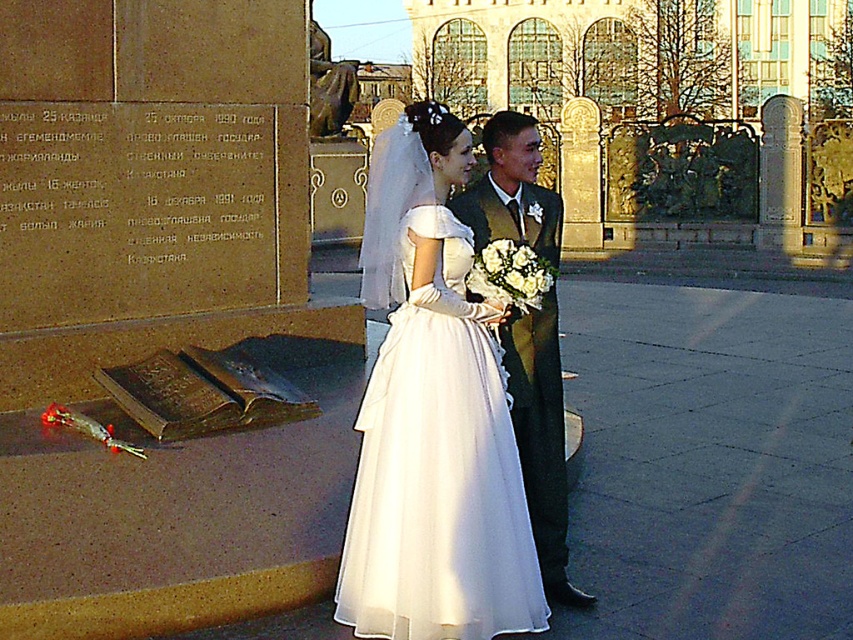
Looking at this image, you are a photographer at the wedding and need to adjust the camera focus. Since the white tulle dress at center and the shiny dark green suit at center are both in the frame, which one should you focus on first if you want to ensure the shorter one is sharp?

The white tulle dress at center is shorter than the shiny dark green suit at center, so you should focus on the white tulle dress at center first to ensure it is sharp.

You are a photographer at the wedding and want to ensure both the white tulle dress at center and the shiny dark green suit at center are fully visible in your shot. Which one requires a wider framing due to its size?

The white tulle dress at center requires a wider framing because its width surpasses that of the shiny dark green suit at center.